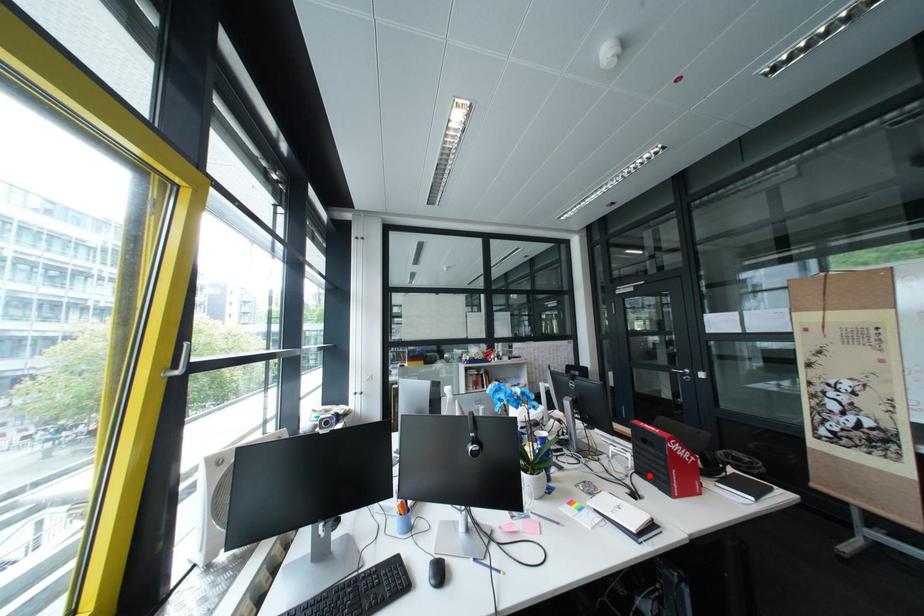
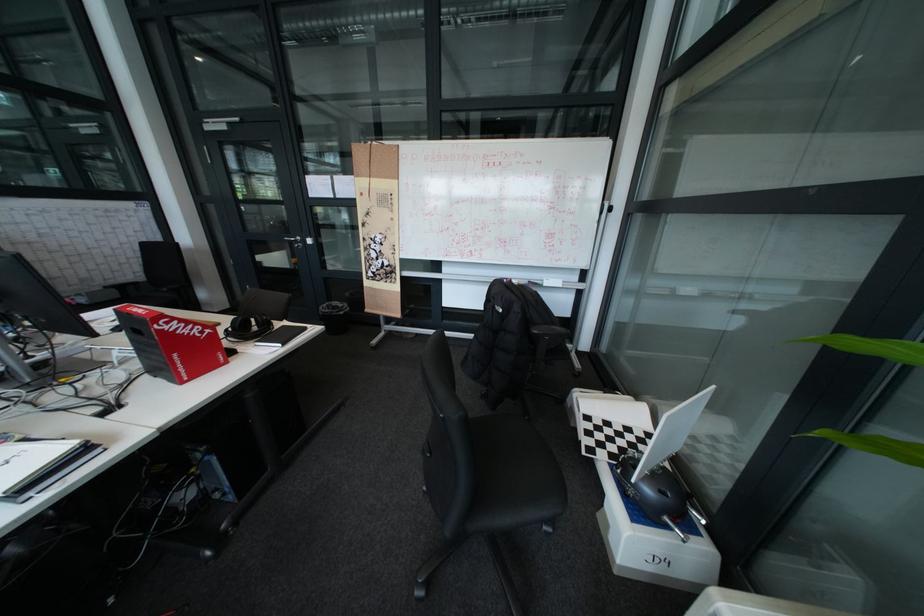
The point at the highlighted location is marked in the first image. Where is the corresponding point in the second image?

(160, 376)